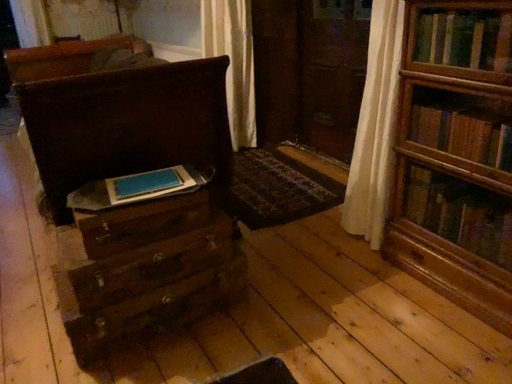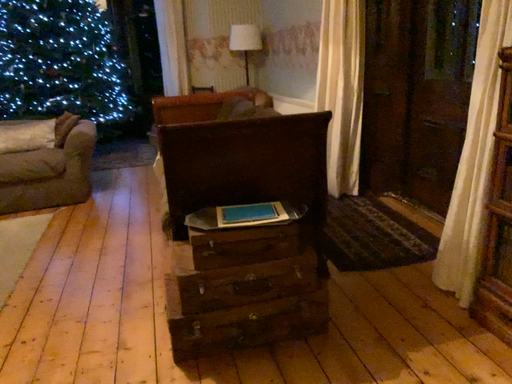
Question: Which way did the camera rotate in the video?

Choices:
 (A) rotated downward
 (B) rotated upward

Answer: (B)